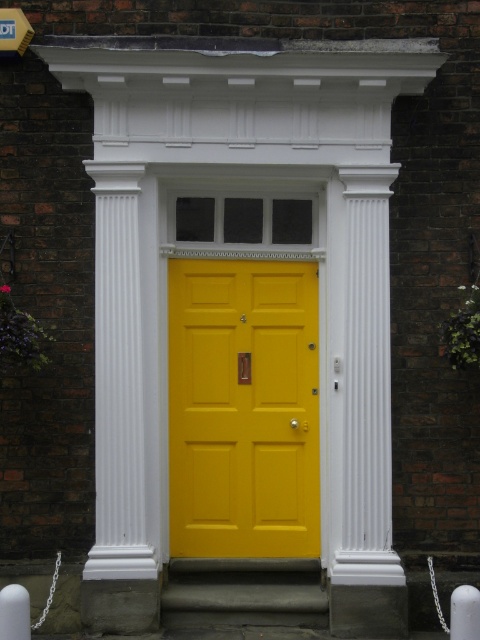
Question: Does concrete at center come in front of metallic yellow street sign at upper left?

Choices:
 (A) no
 (B) yes

Answer: (B)

Question: Is matte yellow door at center smaller than metallic yellow street sign at upper left?

Choices:
 (A) yes
 (B) no

Answer: (B)

Question: Which point is closer to the camera?

Choices:
 (A) metallic yellow street sign at upper left
 (B) concrete at center
 (C) matte yellow door at center

Answer: (B)

Question: Which point is farther from the camera taking this photo?

Choices:
 (A) (199, 577)
 (B) (242, 278)
 (C) (1, 10)

Answer: (B)

Question: In this image, where is concrete at center located relative to metallic yellow street sign at upper left?

Choices:
 (A) right
 (B) left

Answer: (A)

Question: Which of these objects is positioned closest to the concrete at center?

Choices:
 (A) matte yellow door at center
 (B) metallic yellow street sign at upper left

Answer: (A)